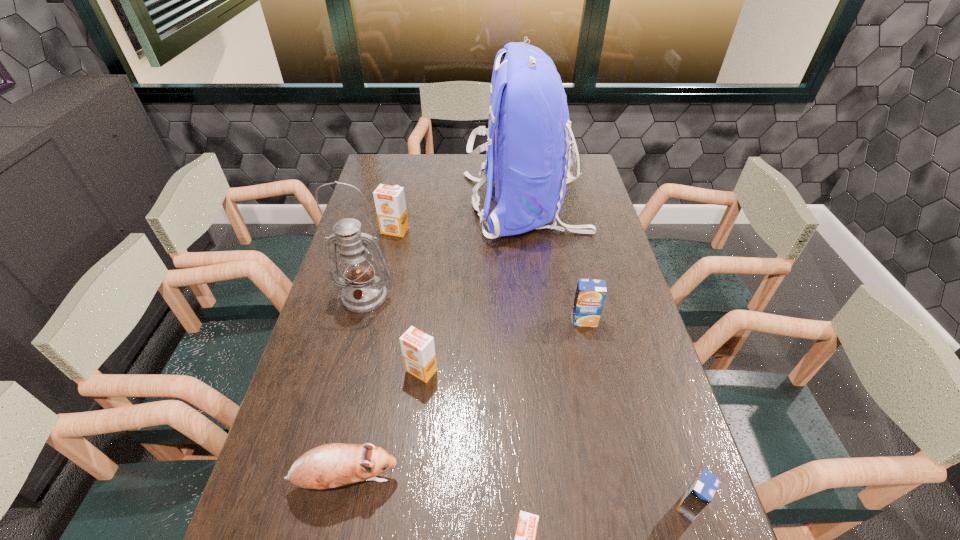
Identify which object is the sixth nearest to the farthest orange orange juice. Please provide its 2D coordinates. Your answer should be formatted as a tuple, i.e. [(x, y)], where the tuple contains the x and y coordinates of a point satisfying the conditions above.

[(526, 530)]

Locate which orange juice ranks fourth in proximity to the second nearest orange orange juice. Please provide its 2D coordinates. Your answer should be formatted as a tuple, i.e. [(x, y)], where the tuple contains the x and y coordinates of a point satisfying the conditions above.

[(700, 493)]

Identify which orange juice is the third closest to the backpack. Please provide its 2D coordinates. Your answer should be formatted as a tuple, i.e. [(x, y)], where the tuple contains the x and y coordinates of a point satisfying the conditions above.

[(418, 349)]

You are a GUI agent. You are given a task and a screenshot of the screen. Output one action in this format:
    pyautogui.click(x=<x>, y=<y>)
    Task: Click on the orange orange juice that is the closest to the bigger blue orange_juice
    
    Given the screenshot: What is the action you would take?
    pyautogui.click(x=418, y=349)

Locate an element on the screen. orange orange juice that stands as the third closest to the gray oil lamp is located at coordinates (526, 530).

Find the location of a particular element. The height and width of the screenshot is (540, 960). vacant space that satisfies the following two spatial constraints: 1. on the back of the smaller blue orange_juice; 2. on the right side of the backpack is located at coordinates (562, 505).